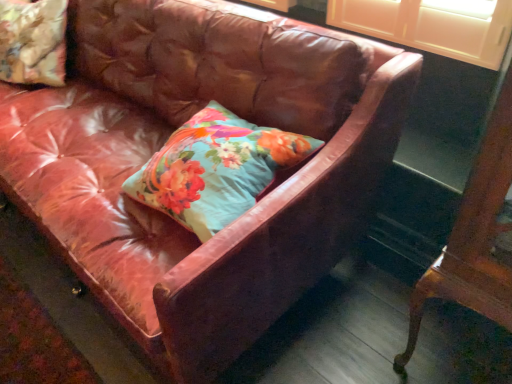
This screenshot has height=384, width=512. In order to click on blank space situated above floral fabric pillow at center, the second pillow from the back (from a real-world perspective) in this screenshot , I will do `click(236, 136)`.